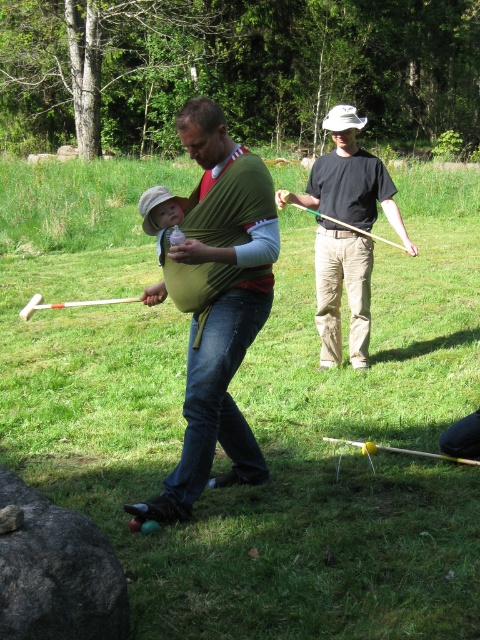
Question: Can you confirm if green fabric baby carrier at center is thinner than black cotton shirt at center?

Choices:
 (A) yes
 (B) no

Answer: (B)

Question: Can you confirm if green fabric baby carrier at center is positioned to the right of black cotton shirt at center?

Choices:
 (A) no
 (B) yes

Answer: (A)

Question: Can you confirm if green fabric baby carrier at center is bigger than black cotton shirt at center?

Choices:
 (A) no
 (B) yes

Answer: (B)